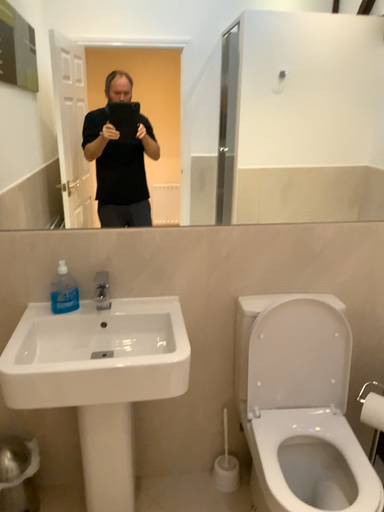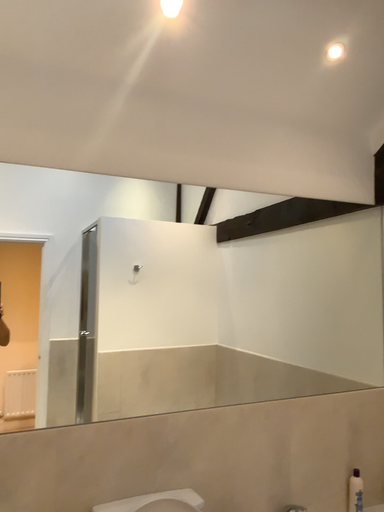
Question: How did the camera likely rotate when shooting the video?

Choices:
 (A) rotated left
 (B) rotated right

Answer: (B)